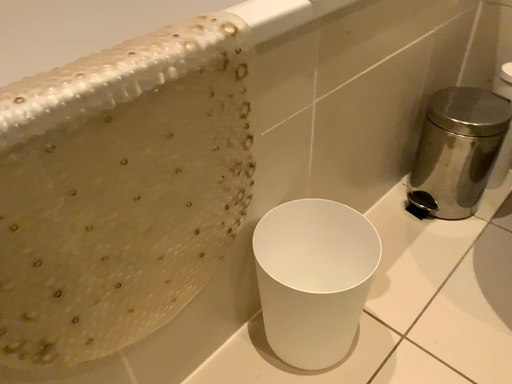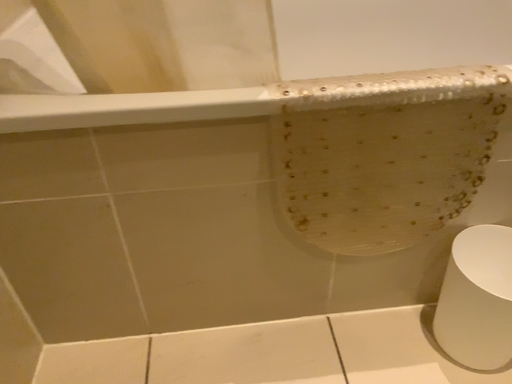
Question: How did the camera likely rotate when shooting the video?

Choices:
 (A) rotated downward
 (B) rotated upward

Answer: (B)